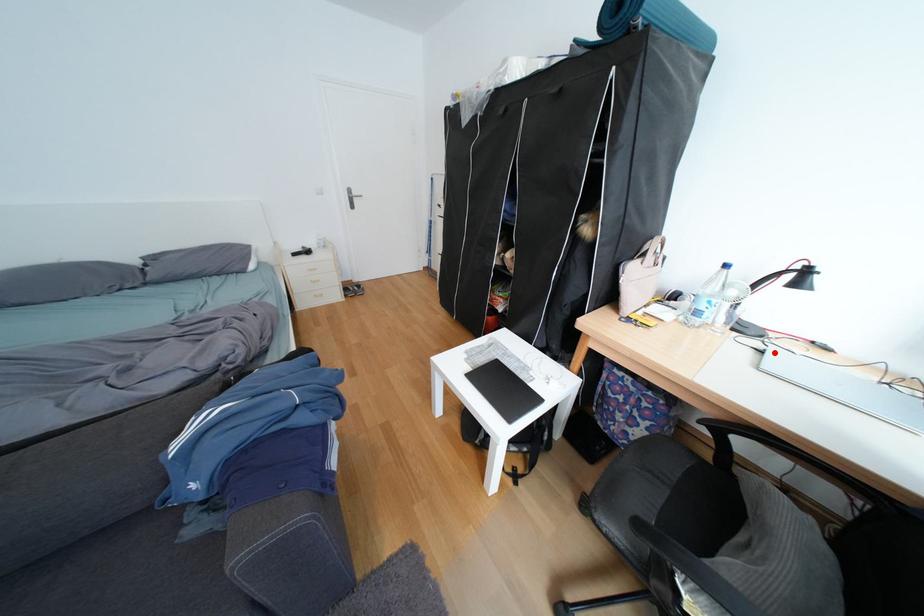
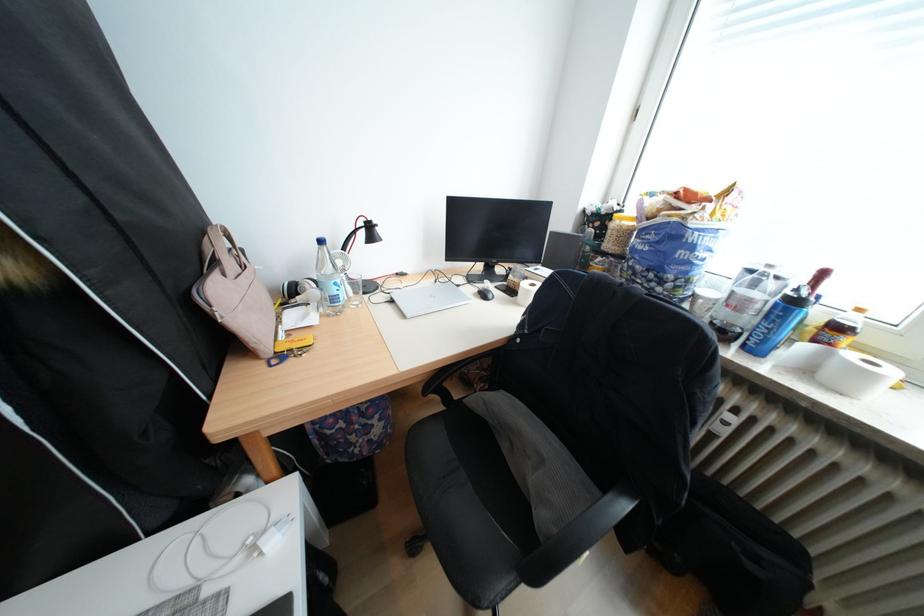
In the second image, find the point that corresponds to the highlighted location in the first image.

(405, 302)